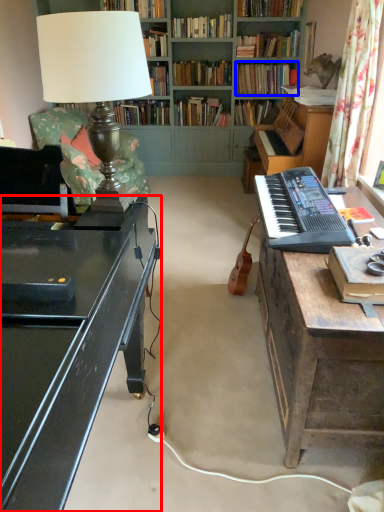
Question: Which of the following is the farthest to the observer, desk (highlighted by a red box) or book (highlighted by a blue box)?

Choices:
 (A) desk
 (B) book

Answer: (B)